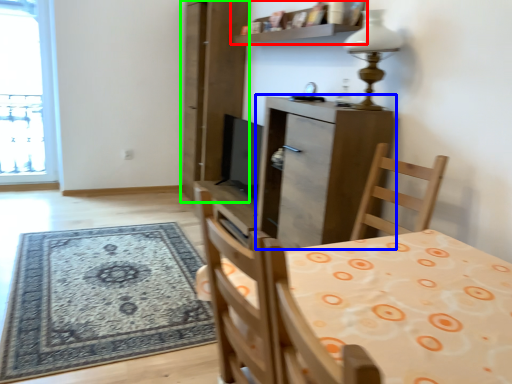
Question: Which is farther away from shelf (highlighted by a red box)? cabinetry (highlighted by a blue box) or screen door (highlighted by a green box)?

Choices:
 (A) cabinetry
 (B) screen door

Answer: (A)